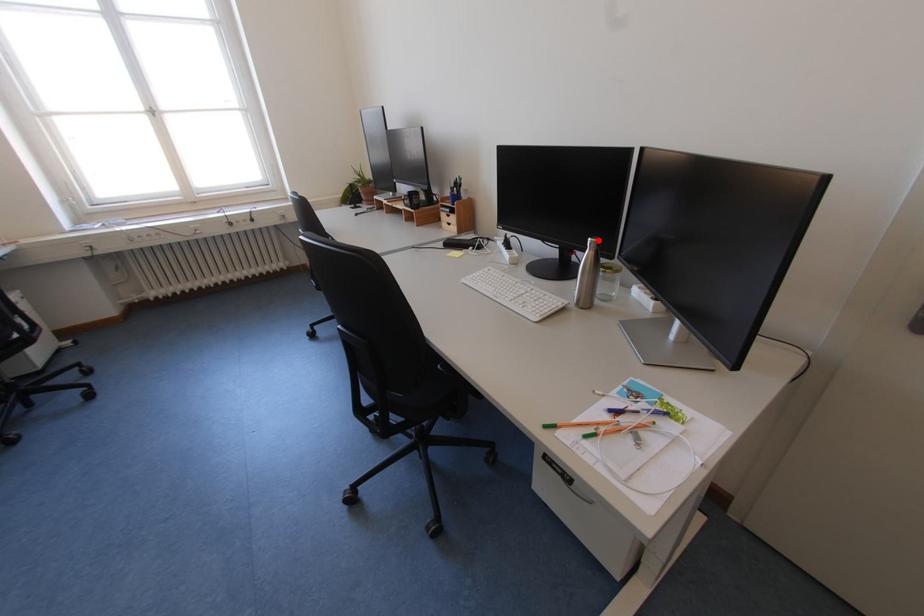
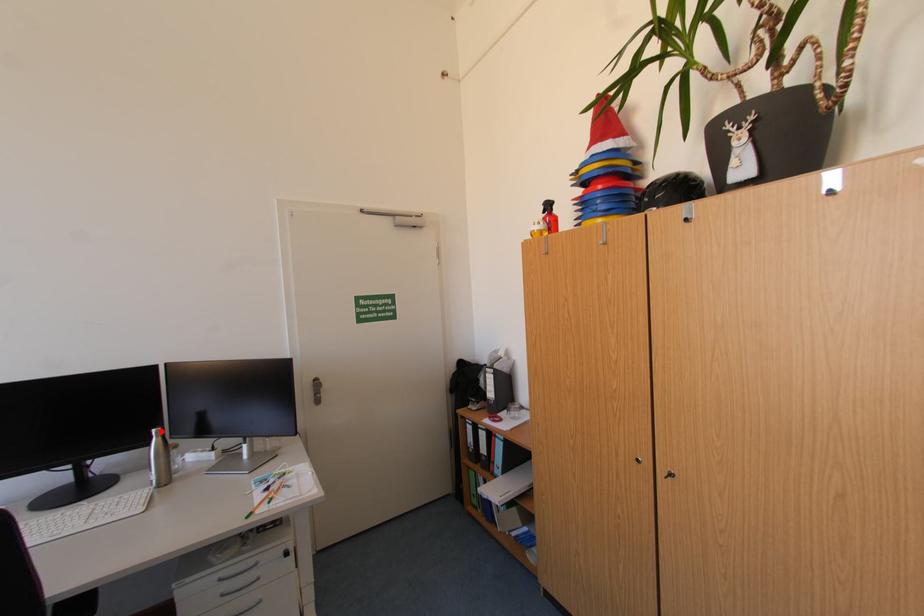
I am providing you with two images of the same scene from different viewpoints. A red point is marked on the first image and another point is marked on the second image. Do the highlighted points in image1 and image2 indicate the same real-world spot?

Yes